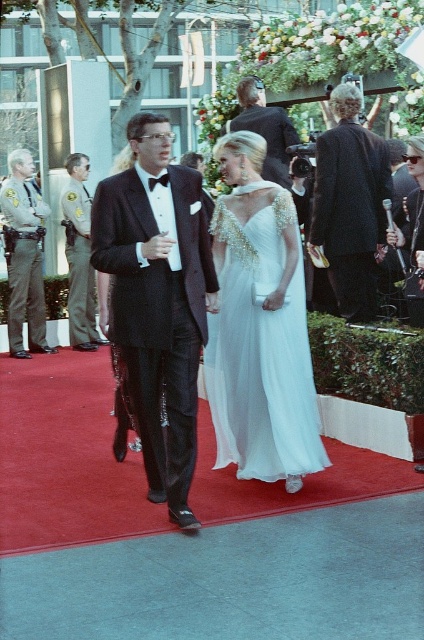
Does shiny black tuxedo at center have a larger size compared to gray uniformed officer at left?

Yes.

Can you confirm if shiny black tuxedo at center is positioned to the left of gray uniformed officer at left?

No, shiny black tuxedo at center is not to the left of gray uniformed officer at left.

Which is in front, point (159, 472) or point (13, 336)?

Point (159, 472) is more forward.

Locate an element on the screen. shiny black tuxedo at center is located at coordinates (158, 300).

Is white chiffon dress at center in front of shiny black suit at center?

Yes, white chiffon dress at center is closer to the viewer.

Is point (270, 320) positioned behind point (284, 124)?

That is False.

Between point (289, 381) and point (250, 99), which one is positioned in front?

Positioned in front is point (289, 381).

You are a GUI agent. You are given a task and a screenshot of the screen. Output one action in this format:
    pyautogui.click(x=<x>, y=<y>)
    Task: Click on the white chiffon dress at center
    The height and width of the screenshot is (640, 424).
    Given the screenshot: What is the action you would take?
    pyautogui.click(x=261, y=348)

Which of these two, dark gray uniform at left or shiny black suit at center, stands shorter?

shiny black suit at center

Does point (69, 314) come in front of point (247, 83)?

No, it is not.

Between point (83, 221) and point (262, 112), which one is positioned in front?

Point (262, 112) is more forward.

Image resolution: width=424 pixels, height=640 pixels. I want to click on dark gray uniform at left, so pyautogui.click(x=78, y=256).